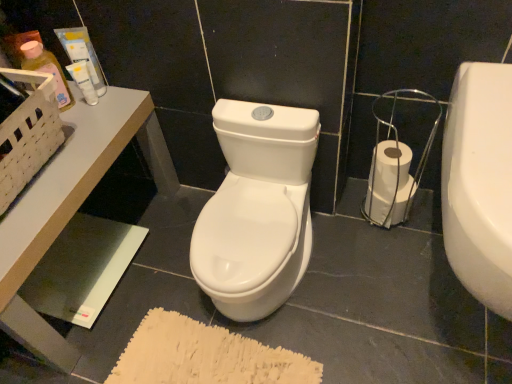
What do you see at coordinates (84, 55) in the screenshot? This screenshot has width=512, height=384. I see `matte plastic tube at upper left, which ranks as the second toiletry in left-to-right order` at bounding box center [84, 55].

Measure the distance between white glossy toilet paper at lower right and camera.

They are 3.34 feet apart.

The width and height of the screenshot is (512, 384). Describe the element at coordinates (62, 210) in the screenshot. I see `white glossy table at upper left` at that location.

The image size is (512, 384). Find the location of `matte plastic tube at upper left, the second toiletry when ordered from right to left`. matte plastic tube at upper left, the second toiletry when ordered from right to left is located at coordinates click(x=84, y=55).

The image size is (512, 384). What are the coordinates of `the 1st toiletry in front of the white matte tube at upper left, arranged as the 3th toiletry when viewed from the left, starting your count from the anchor` in the screenshot? It's located at (84, 55).

Is white matte tube at upper left, arranged as the 3th toiletry when viewed from the left, in front of or behind matte plastic tube at upper left, which ranks as the second toiletry in left-to-right order, in the image?

Clearly, white matte tube at upper left, arranged as the 3th toiletry when viewed from the left, is behind matte plastic tube at upper left, which ranks as the second toiletry in left-to-right order.

Is white matte tube at upper left, arranged as the first toiletry when viewed from the right, facing away from matte plastic tube at upper left, the second toiletry when ordered from right to left?

Yes, white matte tube at upper left, arranged as the first toiletry when viewed from the right, is positioned with its back facing matte plastic tube at upper left, the second toiletry when ordered from right to left.

Considering the positions of objects white matte tube at upper left, arranged as the first toiletry when viewed from the right, and matte plastic tube at upper left, which ranks as the second toiletry in left-to-right order, in the image provided, who is more to the right, white matte tube at upper left, arranged as the first toiletry when viewed from the right, or matte plastic tube at upper left, which ranks as the second toiletry in left-to-right order,?

white matte tube at upper left, arranged as the first toiletry when viewed from the right.

Locate an element on the screen. the 2nd toiletry positioned above the translucent plastic bottle at upper left, which appears as the 1th toiletry when viewed from the left (from the image's perspective) is located at coordinates (x=84, y=55).

From a real-world perspective, is translucent plastic bottle at upper left, acting as the third toiletry starting from the right, over matte plastic tube at upper left, which ranks as the second toiletry in left-to-right order?

Yes, from a real-world perspective, translucent plastic bottle at upper left, acting as the third toiletry starting from the right, is over matte plastic tube at upper left, which ranks as the second toiletry in left-to-right order

Considering the points (64, 93) and (88, 51), which point is in front, point (64, 93) or point (88, 51)?

The point (88, 51) is closer to the camera.

How different are the orientations of white glossy toilet paper at lower right and translucent plastic bottle at upper left, which appears as the 1th toiletry when viewed from the left, in degrees?

white glossy toilet paper at lower right and translucent plastic bottle at upper left, which appears as the 1th toiletry when viewed from the left, are facing 64.3 degrees away from each other.

Is translucent plastic bottle at upper left, acting as the third toiletry starting from the right, located within white glossy toilet paper at lower right?

No.

How much distance is there between white glossy toilet paper at lower right and translucent plastic bottle at upper left, which appears as the 1th toiletry when viewed from the left?

They are 32.06 inches apart.

Can you confirm if white glossy toilet paper at lower right is taller than translucent plastic bottle at upper left, which appears as the 1th toiletry when viewed from the left?

Yes, white glossy toilet paper at lower right is taller than translucent plastic bottle at upper left, which appears as the 1th toiletry when viewed from the left.

Which object is more forward, matte plastic tube at upper left, the second toiletry when ordered from right to left, or white glossy toilet paper at lower right?

matte plastic tube at upper left, the second toiletry when ordered from right to left.

Looking at this image, from the image's perspective, would you say matte plastic tube at upper left, which ranks as the second toiletry in left-to-right order, is positioned over white glossy toilet paper at lower right?

Yes.

Considering the sizes of objects matte plastic tube at upper left, the second toiletry when ordered from right to left, and white glossy toilet paper at lower right in the image provided, who is shorter, matte plastic tube at upper left, the second toiletry when ordered from right to left, or white glossy toilet paper at lower right?

matte plastic tube at upper left, the second toiletry when ordered from right to left, is shorter.

Looking at their sizes, would you say matte plastic tube at upper left, which ranks as the second toiletry in left-to-right order, is wider or thinner than white glossy toilet paper at lower right?

matte plastic tube at upper left, which ranks as the second toiletry in left-to-right order, is thinner than white glossy toilet paper at lower right.

Can you confirm if white glossy table at upper left is thinner than white matte tube at upper left, arranged as the first toiletry when viewed from the right?

Incorrect, the width of white glossy table at upper left is not less than that of white matte tube at upper left, arranged as the first toiletry when viewed from the right.

Does point (53, 329) lie in front of point (82, 69)?

Yes, point (53, 329) is in front of point (82, 69).

Looking at this image, would you consider white glossy table at upper left to be distant from white matte tube at upper left, arranged as the 3th toiletry when viewed from the left?

No.

Is white glossy table at upper left situated inside white matte tube at upper left, arranged as the 3th toiletry when viewed from the left, or outside?

white glossy table at upper left is located beyond the bounds of white matte tube at upper left, arranged as the 3th toiletry when viewed from the left.

Is white matte tube at upper left, arranged as the first toiletry when viewed from the right, next to translucent plastic bottle at upper left, which appears as the 1th toiletry when viewed from the left?

Indeed, white matte tube at upper left, arranged as the first toiletry when viewed from the right, and translucent plastic bottle at upper left, which appears as the 1th toiletry when viewed from the left, are beside each other and touching.

Does white matte tube at upper left, arranged as the 3th toiletry when viewed from the left, come in front of translucent plastic bottle at upper left, acting as the third toiletry starting from the right?

No, white matte tube at upper left, arranged as the 3th toiletry when viewed from the left, is behind translucent plastic bottle at upper left, acting as the third toiletry starting from the right.

From a real-world perspective, between matte plastic tube at upper left, which ranks as the second toiletry in left-to-right order, and white glossy table at upper left, who is vertically lower?

white glossy table at upper left, from a real-world perspective.

What are the coordinates of `table below the matte plastic tube at upper left, the second toiletry when ordered from right to left (from a real-world perspective)` in the screenshot? It's located at (62, 210).

Which of these two, matte plastic tube at upper left, which ranks as the second toiletry in left-to-right order, or white glossy table at upper left, is bigger?

white glossy table at upper left is bigger.

Does matte plastic tube at upper left, the second toiletry when ordered from right to left, lie in front of white glossy table at upper left?

No, the depth of matte plastic tube at upper left, the second toiletry when ordered from right to left, is greater than that of white glossy table at upper left.

This screenshot has height=384, width=512. Find the location of `the 1st toiletry to the left of the white matte tube at upper left, arranged as the 3th toiletry when viewed from the left, counting from the anchor's position`. the 1st toiletry to the left of the white matte tube at upper left, arranged as the 3th toiletry when viewed from the left, counting from the anchor's position is located at coordinates [x=84, y=55].

Identify the location of toiletry above the matte plastic tube at upper left, which ranks as the second toiletry in left-to-right order (from a real-world perspective). The width and height of the screenshot is (512, 384). (47, 70).

Considering their positions, is translucent plastic bottle at upper left, acting as the third toiletry starting from the right, positioned further to white matte tube at upper left, arranged as the first toiletry when viewed from the right, than matte plastic tube at upper left, the second toiletry when ordered from right to left?

translucent plastic bottle at upper left, acting as the third toiletry starting from the right, is further to white matte tube at upper left, arranged as the first toiletry when viewed from the right.

Based on their spatial positions, is translucent plastic bottle at upper left, which appears as the 1th toiletry when viewed from the left, or white matte tube at upper left, arranged as the first toiletry when viewed from the right, further from white glossy toilet paper at lower right?

translucent plastic bottle at upper left, which appears as the 1th toiletry when viewed from the left.

Looking at this image, estimate the real-world distances between objects in this image. Which object is further from matte plastic tube at upper left, the second toiletry when ordered from right to left, white matte tube at upper left, arranged as the first toiletry when viewed from the right, or translucent plastic bottle at upper left, acting as the third toiletry starting from the right?

translucent plastic bottle at upper left, acting as the third toiletry starting from the right, is positioned further to the anchor matte plastic tube at upper left, the second toiletry when ordered from right to left.

Estimate the real-world distances between objects in this image. Which object is further from translucent plastic bottle at upper left, acting as the third toiletry starting from the right, white glossy table at upper left or white matte tube at upper left, arranged as the first toiletry when viewed from the right?

The object further to translucent plastic bottle at upper left, acting as the third toiletry starting from the right, is white glossy table at upper left.

From the image, which object appears to be farther from matte plastic tube at upper left, the second toiletry when ordered from right to left, white glossy toilet paper at lower right or white matte tube at upper left, arranged as the 3th toiletry when viewed from the left?

white glossy toilet paper at lower right.

Which object lies nearer to the anchor point white glossy table at upper left, white glossy toilet paper at lower right or matte plastic tube at upper left, which ranks as the second toiletry in left-to-right order?

The object closer to white glossy table at upper left is matte plastic tube at upper left, which ranks as the second toiletry in left-to-right order.

From the image, which object appears to be nearer to white glossy toilet paper at lower right, translucent plastic bottle at upper left, which appears as the 1th toiletry when viewed from the left, or matte plastic tube at upper left, which ranks as the second toiletry in left-to-right order?

Based on the image, matte plastic tube at upper left, which ranks as the second toiletry in left-to-right order, appears to be nearer to white glossy toilet paper at lower right.

From the image, which object appears to be nearer to white glossy toilet paper at lower right, white glossy table at upper left or white matte tube at upper left, arranged as the 3th toiletry when viewed from the left?

The object closer to white glossy toilet paper at lower right is white glossy table at upper left.

Image resolution: width=512 pixels, height=384 pixels. Find the location of `toiletry located between translucent plastic bottle at upper left, which appears as the 1th toiletry when viewed from the left, and white matte tube at upper left, arranged as the first toiletry when viewed from the right, in the left-right direction`. toiletry located between translucent plastic bottle at upper left, which appears as the 1th toiletry when viewed from the left, and white matte tube at upper left, arranged as the first toiletry when viewed from the right, in the left-right direction is located at coordinates (84, 55).

This screenshot has height=384, width=512. I want to click on toiletry between matte plastic tube at upper left, the second toiletry when ordered from right to left, and white glossy toilet paper at lower right from left to right, so click(83, 81).

What are the coordinates of `toiletry between white matte tube at upper left, arranged as the 3th toiletry when viewed from the left, and white glossy table at upper left from top to bottom` in the screenshot? It's located at (47, 70).